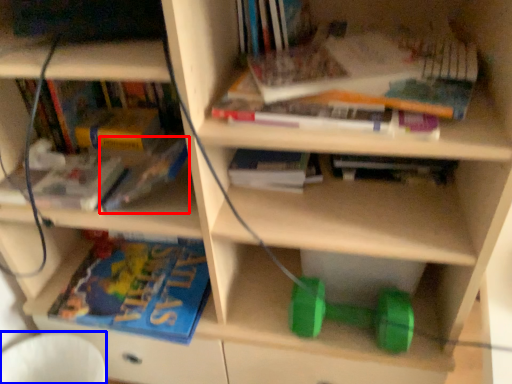
Question: Which object is further to the camera taking this photo, book (highlighted by a red box) or swivel chair (highlighted by a blue box)?

Choices:
 (A) book
 (B) swivel chair

Answer: (B)